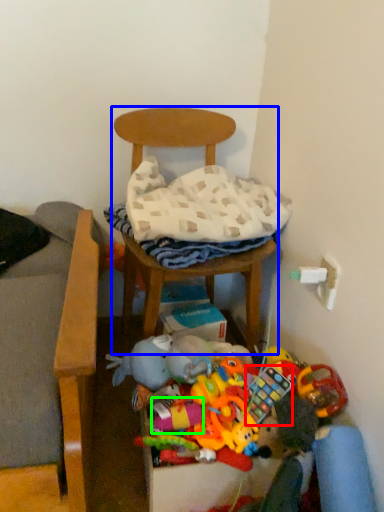
Question: Which object is the farthest from toy (highlighted by a red box)? Choose among these: chair (highlighted by a blue box) or toy (highlighted by a green box).

Choices:
 (A) chair
 (B) toy

Answer: (A)